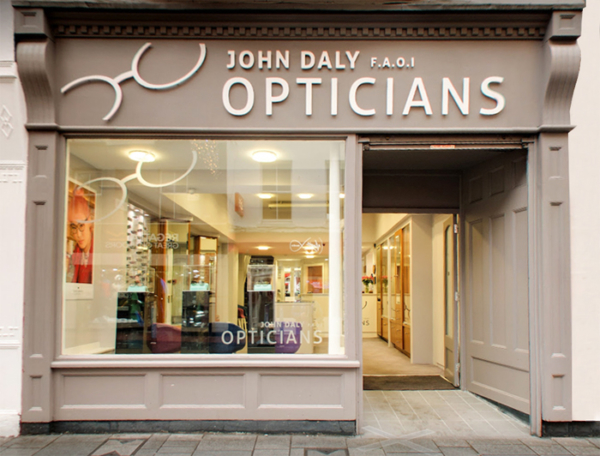
You are a GUI agent. You are given a task and a screenshot of the screen. Output one action in this format:
    pyautogui.click(x=<x>, y=<y>)
    Task: Click on the purple waiting chair
    
    Given the screenshot: What is the action you would take?
    pyautogui.click(x=285, y=350)